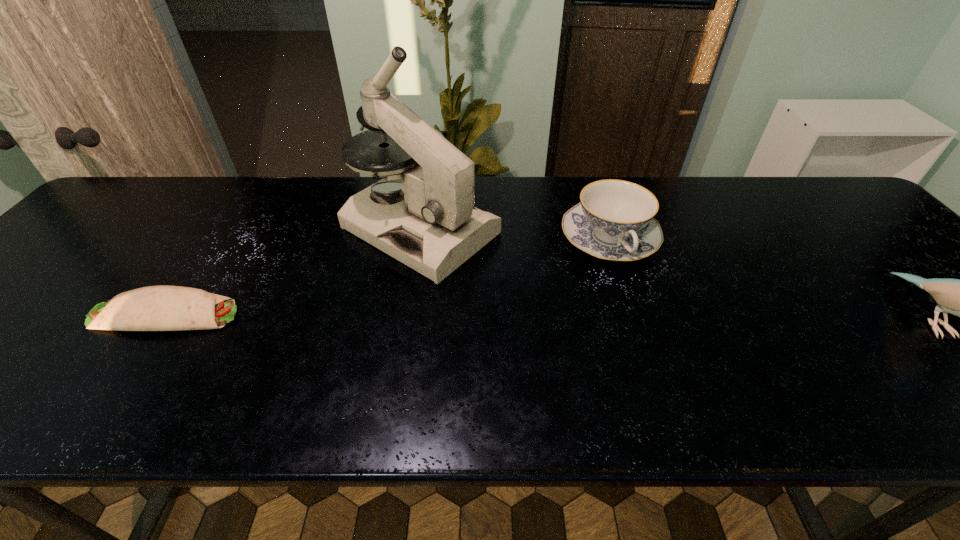
Where is `free spot on the desktop that is between the shortest object and the third shortest object and is positioned at the eyepiece of the tallest object`? free spot on the desktop that is between the shortest object and the third shortest object and is positioned at the eyepiece of the tallest object is located at coordinates (585, 316).

You are a GUI agent. You are given a task and a screenshot of the screen. Output one action in this format:
    pyautogui.click(x=<x>, y=<y>)
    Task: Click on the free space on the desktop that is between the leftmost object and the bird and is positioned with the handle on the side of the third tallest object
    The image size is (960, 540).
    Given the screenshot: What is the action you would take?
    pyautogui.click(x=658, y=317)